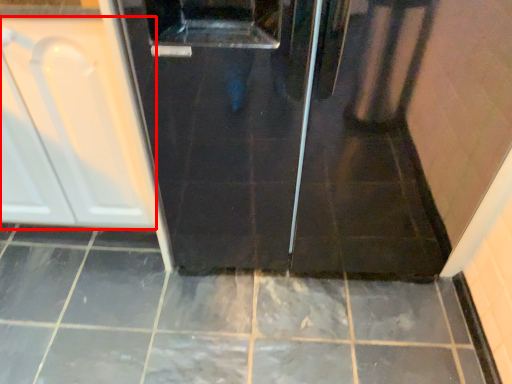
Question: From the image's perspective, where is cabinetry (annotated by the red box) located in relation to ceramic tile in the image?

Choices:
 (A) below
 (B) above

Answer: (B)